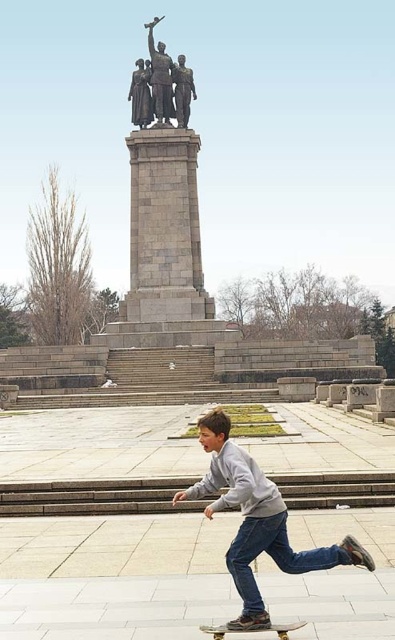
You are an art curator planning to install a new sculpture in the plaza. You need to know which statue, the polished bronze statue at upper center or the bronze statue at center, is wider to determine placement. Which one is wider?

The polished bronze statue at upper center is wider than the bronze statue at center, so it should be placed in a location that accommodates its width.

You are a photographer trying to capture both the gray sweatshirt at lower center and the polished bronze statue at center in a single frame. Based on their heights, which object should you focus on first to ensure both are in the shot?

The gray sweatshirt at lower center has a lesser height compared to the polished bronze statue at center, so you should focus on the polished bronze statue at center first to ensure both are in the shot.

You are a photographer trying to capture the skateboarder and the monument in one shot. To ensure both the gray sweatshirt at lower center and the wooden skateboard at lower center are visible, where should you position the camera relative to the skateboarder?

Position the camera to the right of the skateboarder so that the gray sweatshirt at lower center, which is to the left of the wooden skateboard at lower center, remains visible in the frame along with the monument in the background.